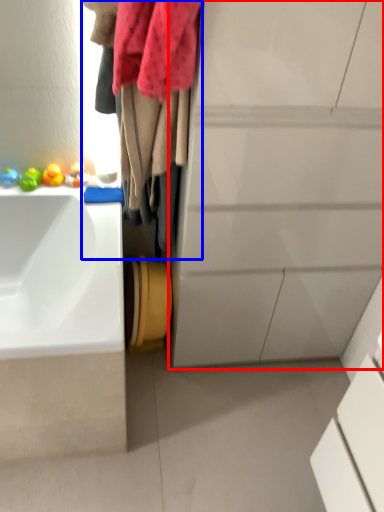
Question: Which of the following is the closest to the observer, bathroom cabinet (highlighted by a red box) or laundry (highlighted by a blue box)?

Choices:
 (A) bathroom cabinet
 (B) laundry

Answer: (A)